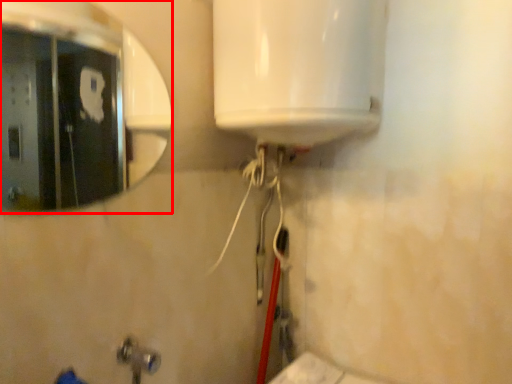
Question: In this image, where is mirror (annotated by the red box) located relative to plumbing fixture?

Choices:
 (A) right
 (B) left

Answer: (B)